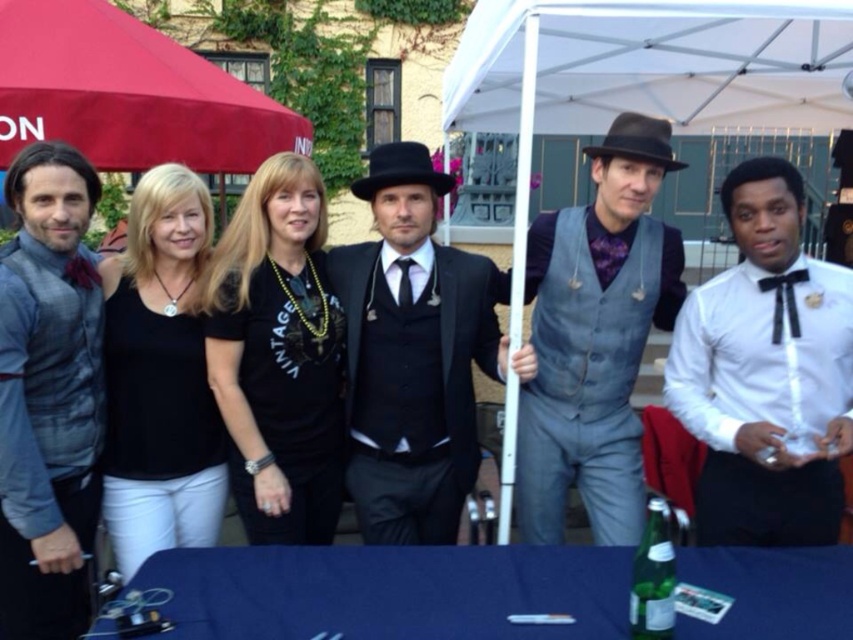
Question: Based on their relative distances, which object is nearer to the black matte tank top at center?

Choices:
 (A) matte gray vest at center
 (B) white satin shirt at right
 (C) blue fabric table at lower center
 (D) brushed metal vest at left

Answer: (D)

Question: Does white fabric canopy at upper center appear on the left side of black velvet suit at center?

Choices:
 (A) no
 (B) yes

Answer: (A)

Question: Which point is closer to the camera taking this photo?

Choices:
 (A) (512, 556)
 (B) (544, 54)

Answer: (A)

Question: Which of the following is the farthest from the observer?

Choices:
 (A) (785, 67)
 (B) (389, 220)
 (C) (305, 323)

Answer: (A)

Question: From the image, what is the correct spatial relationship of blue fabric table at lower center in relation to black velvet suit at center?

Choices:
 (A) left
 (B) right

Answer: (B)

Question: Can you confirm if white satin shirt at right is wider than white fabric canopy at upper center?

Choices:
 (A) yes
 (B) no

Answer: (B)